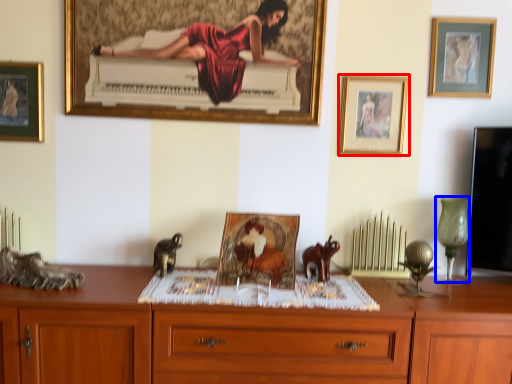
Question: Which object appears farthest to the camera in this image, picture frame (highlighted by a red box) or table lamp (highlighted by a blue box)?

Choices:
 (A) picture frame
 (B) table lamp

Answer: (A)